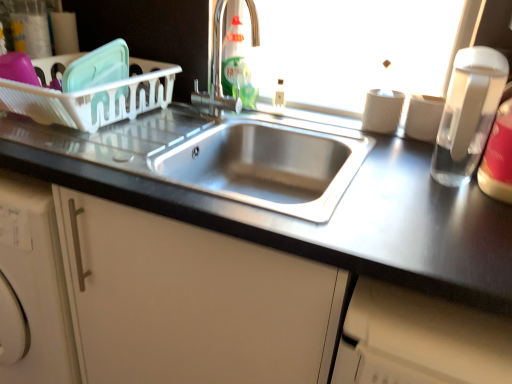
Question: Could you tell me if satin finish cabinet at center is turned towards satin nickel faucet at upper center?

Choices:
 (A) yes
 (B) no

Answer: (B)

Question: Can you confirm if satin finish cabinet at center is bigger than satin nickel faucet at upper center?

Choices:
 (A) yes
 (B) no

Answer: (A)

Question: Is satin finish cabinet at center next to satin nickel faucet at upper center and touching it?

Choices:
 (A) no
 (B) yes

Answer: (A)

Question: Is satin nickel faucet at upper center completely or partially inside satin finish cabinet at center?

Choices:
 (A) yes
 (B) no

Answer: (B)

Question: From a real-world perspective, is satin finish cabinet at center positioned over satin nickel faucet at upper center based on gravity?

Choices:
 (A) yes
 (B) no

Answer: (B)

Question: Do you think clear glass water bottle at right is within stainless steel sink at center, or outside of it?

Choices:
 (A) outside
 (B) inside

Answer: (A)

Question: Does point (493, 82) appear closer or farther from the camera than point (354, 140)?

Choices:
 (A) farther
 (B) closer

Answer: (B)

Question: Considering the positions of clear glass water bottle at right and stainless steel sink at center in the image, is clear glass water bottle at right taller or shorter than stainless steel sink at center?

Choices:
 (A) tall
 (B) short

Answer: (A)

Question: From a real-world perspective, is clear glass water bottle at right physically located above or below stainless steel sink at center?

Choices:
 (A) above
 (B) below

Answer: (A)

Question: Considering the positions of satin nickel faucet at upper center and stainless steel sink at center in the image, is satin nickel faucet at upper center taller or shorter than stainless steel sink at center?

Choices:
 (A) tall
 (B) short

Answer: (A)

Question: Based on their sizes in the image, would you say satin nickel faucet at upper center is bigger or smaller than stainless steel sink at center?

Choices:
 (A) big
 (B) small

Answer: (B)

Question: From the image's perspective, is satin nickel faucet at upper center above or below stainless steel sink at center?

Choices:
 (A) above
 (B) below

Answer: (A)

Question: Is satin nickel faucet at upper center inside the boundaries of stainless steel sink at center, or outside?

Choices:
 (A) inside
 (B) outside

Answer: (B)

Question: From the image's perspective, is satin nickel faucet at upper center located above or below clear plastic bottle at right, which appears as the 3th bottle when viewed from the top?

Choices:
 (A) below
 (B) above

Answer: (B)

Question: Which is correct: satin nickel faucet at upper center is inside clear plastic bottle at right, the 3th bottle viewed from the left, or outside of it?

Choices:
 (A) inside
 (B) outside

Answer: (B)